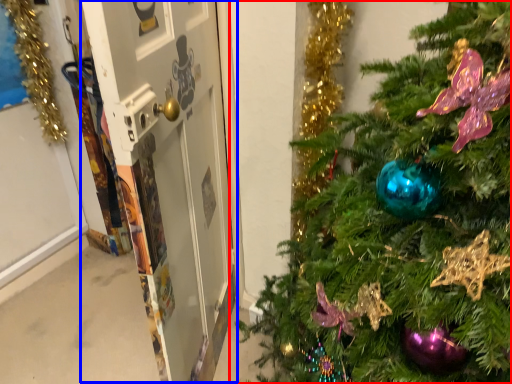
Question: Among these objects, which one is nearest to the camera, christmas tree (highlighted by a red box) or screen door (highlighted by a blue box)?

Choices:
 (A) christmas tree
 (B) screen door

Answer: (A)